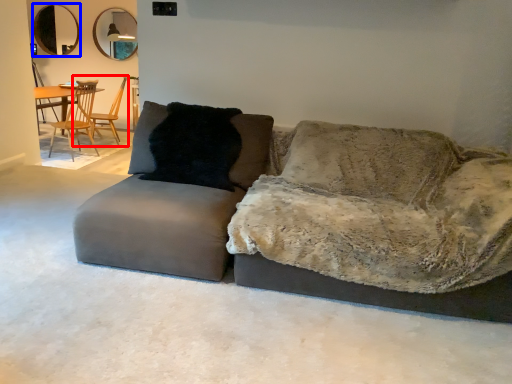
Question: Which point is further to the camera, chair (highlighted by a red box) or mirror (highlighted by a blue box)?

Choices:
 (A) chair
 (B) mirror

Answer: (B)